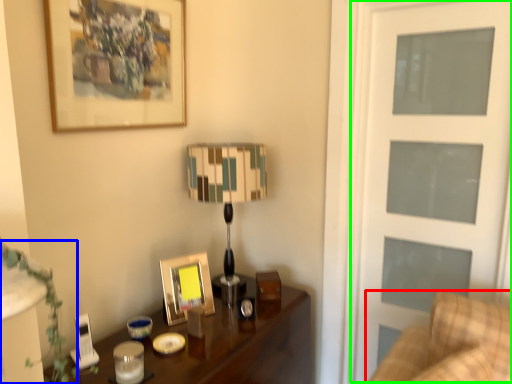
Question: Which object is the closest to the furniture (highlighted by a red box)? Choose among these: plant (highlighted by a blue box) or screen door (highlighted by a green box).

Choices:
 (A) plant
 (B) screen door

Answer: (B)